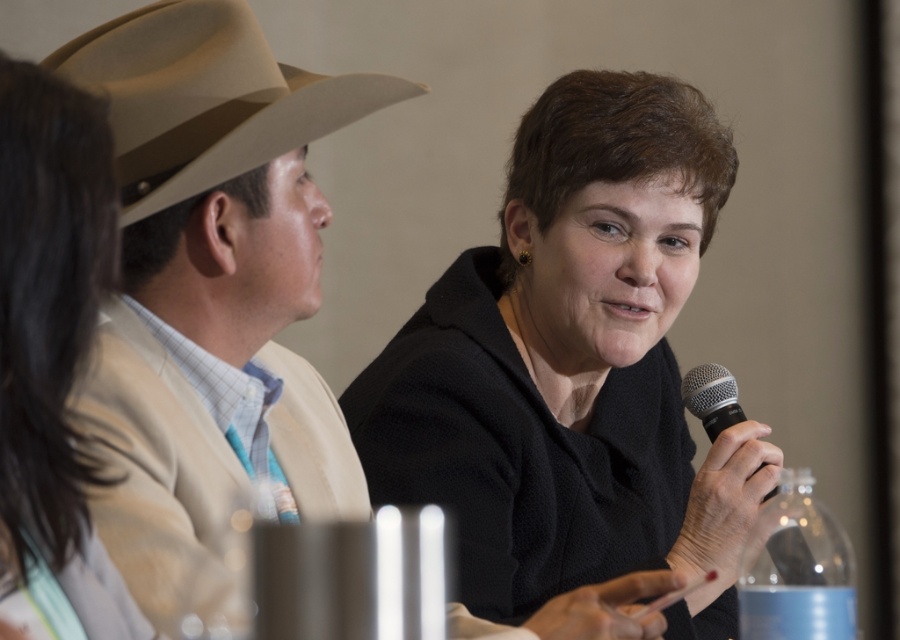
Question: Is brown leather hat at upper left positioned before clear plastic bottle at lower right?

Choices:
 (A) no
 (B) yes

Answer: (B)

Question: Considering the real-world distances, which object is farthest from the beige fabric cowboy hat at upper left?

Choices:
 (A) silver metallic microphone at center
 (B) tan felt cowboy hat at left

Answer: (A)

Question: Is black matte jacket at center smaller than beige fabric cowboy hat at upper left?

Choices:
 (A) yes
 (B) no

Answer: (B)

Question: Based on their relative distances, which object is farther from the tan felt cowboy hat at left?

Choices:
 (A) silver metallic microphone at center
 (B) clear plastic bottle at lower right

Answer: (A)

Question: Is black matte jacket at center thinner than beige fabric cowboy hat at upper left?

Choices:
 (A) no
 (B) yes

Answer: (B)

Question: Based on their relative distances, which object is nearer to the silver metallic microphone at center?

Choices:
 (A) tan felt cowboy hat at left
 (B) clear plastic bottle at lower right
 (C) brown leather hat at upper left
 (D) black matte jacket at center

Answer: (D)